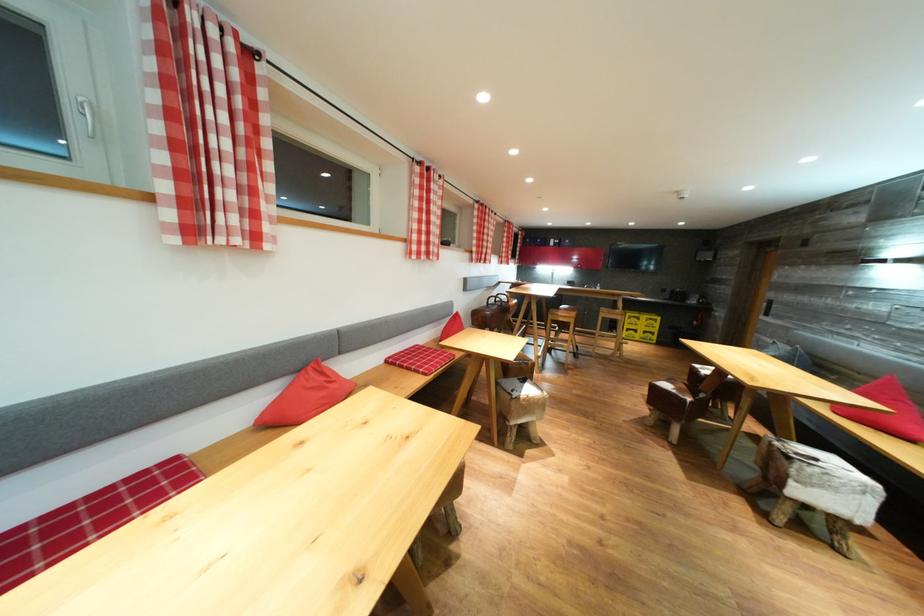
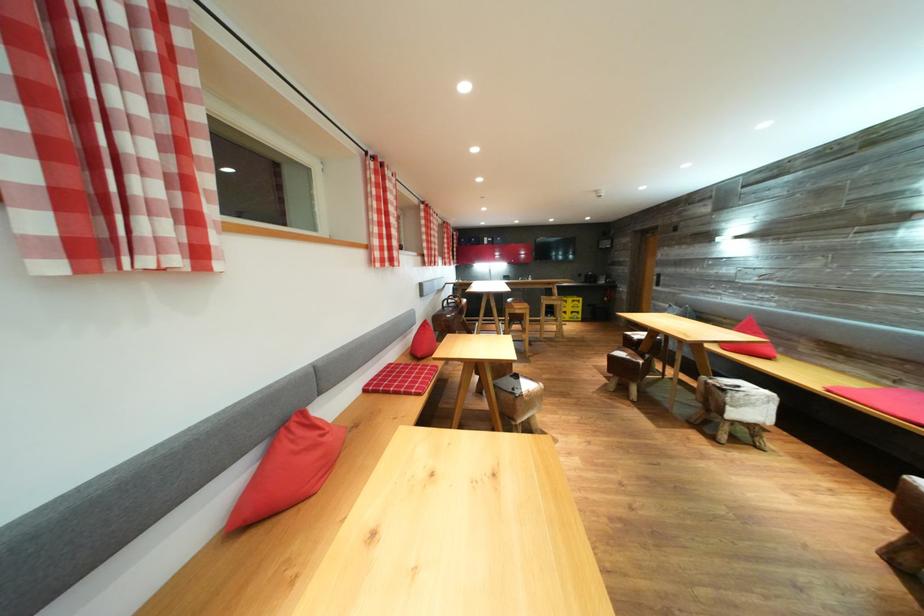
The point at (x=270, y=100) is marked in the first image. Where is the corresponding point in the second image?

(188, 43)